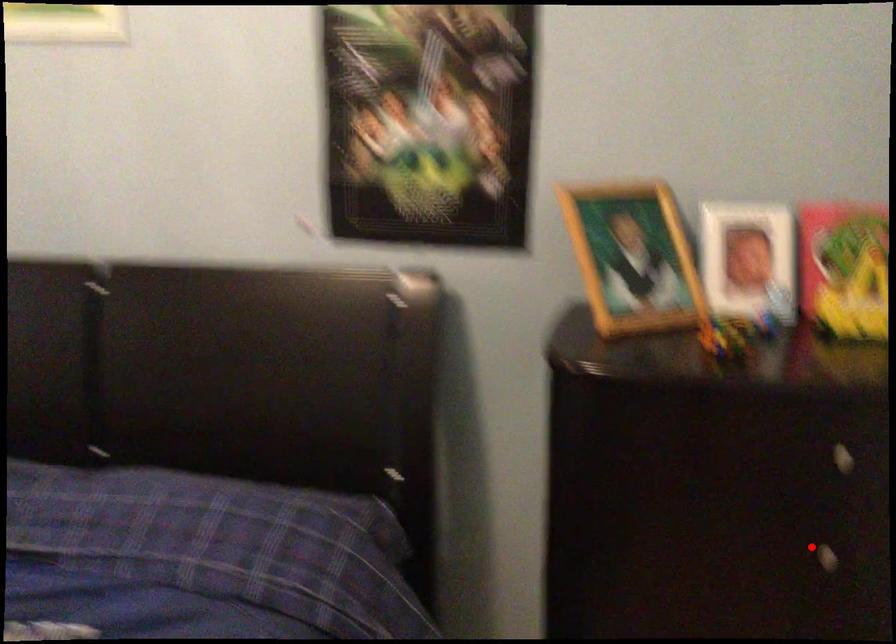
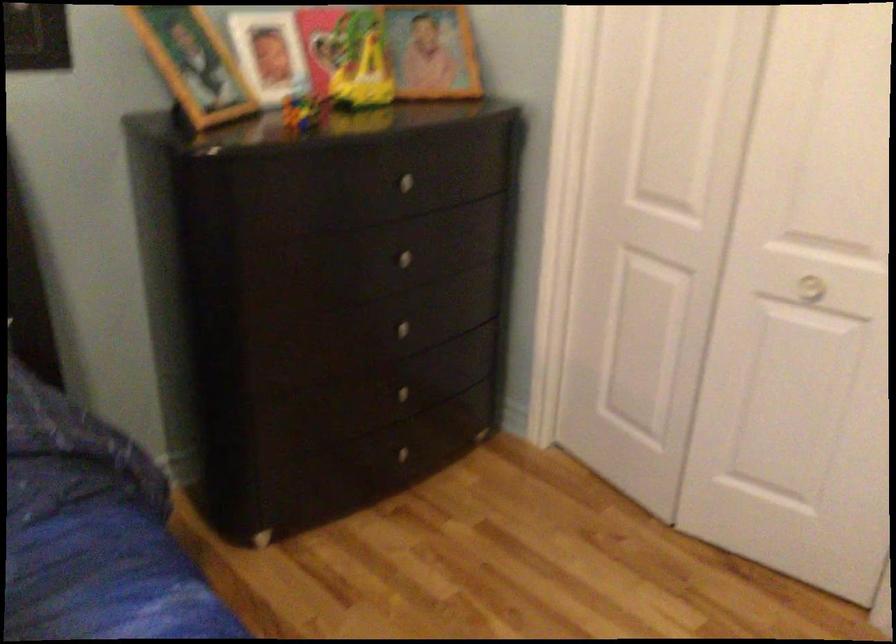
Where in the second image is the point corresponding to the highlighted location from the first image?

(399, 258)